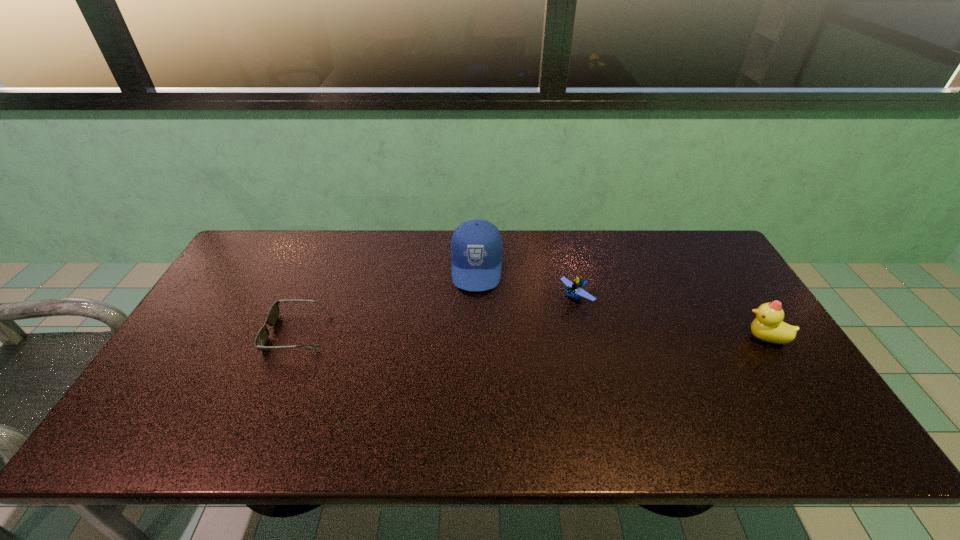
Locate an element on the screen. Image resolution: width=960 pixels, height=540 pixels. free space located 0.280m on the front-facing side of the duckling is located at coordinates (641, 338).

Locate an element on the screen. This screenshot has height=540, width=960. vacant area situated on the front-facing side of the duckling is located at coordinates (708, 338).

Locate an element on the screen. This screenshot has height=540, width=960. vacant region located on the front-facing side of the Lego is located at coordinates (540, 323).

Where is `free location located 0.180m on the front-facing side of the Lego`? The width and height of the screenshot is (960, 540). free location located 0.180m on the front-facing side of the Lego is located at coordinates (522, 335).

The width and height of the screenshot is (960, 540). Identify the location of vacant area situated 0.310m on the front-facing side of the Lego. (486, 359).

Locate an element on the screen. This screenshot has width=960, height=540. blank space located on the front-facing side of the third object from right to left is located at coordinates (473, 369).

At what (x,y) coordinates should I click in order to perform the action: click on vacant space situated on the front-facing side of the third object from right to left. Please return your answer as a coordinate pair (x, y). Image resolution: width=960 pixels, height=540 pixels. Looking at the image, I should click on (473, 357).

The height and width of the screenshot is (540, 960). I want to click on blank space located on the front-facing side of the third object from right to left, so click(x=472, y=373).

Identify the location of object located in the far edge section of the desktop. (476, 247).

Locate an element on the screen. This screenshot has height=540, width=960. object that is at the right edge is located at coordinates (768, 325).